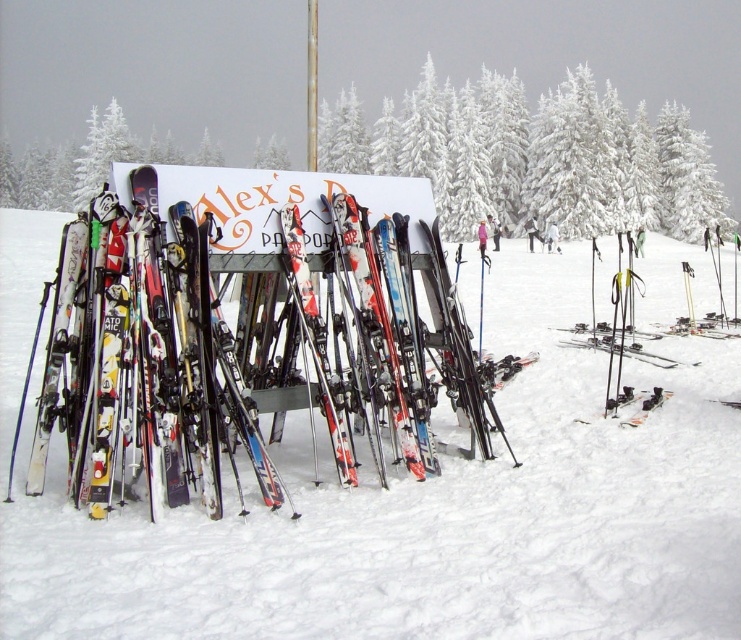
You are standing in front of the ski rack and want to know which of the two points, point (462, 134) or point (581, 420), is closer to you. Can you determine this based on their positions?

Point (462, 134) is further to the camera than point (581, 420), so point (581, 420) is closer to you.

You are a photographer standing at the edge of the snowy area. You want to take a photo of the white matte snow at center. Where should you position yourself to capture the snow in the center of your frame?

The white matte snow at center is located at point 0.786 on the x axis and 0.552 on the y axis, so you should position yourself directly in front of that coordinate to center it in your frame.

In the scene shown: You need to choose between the multicolored plastic skis at center and the matte black ski at lower right for a child who is 4 feet tall. Based on their sizes, which pair might be more suitable?

The multicolored plastic skis at center are wider than the matte black ski at lower right. Since wider skis are generally more stable and easier to control for beginners or shorter individuals, the multicolored plastic skis at center would be more suitable for a 4 feet tall child.